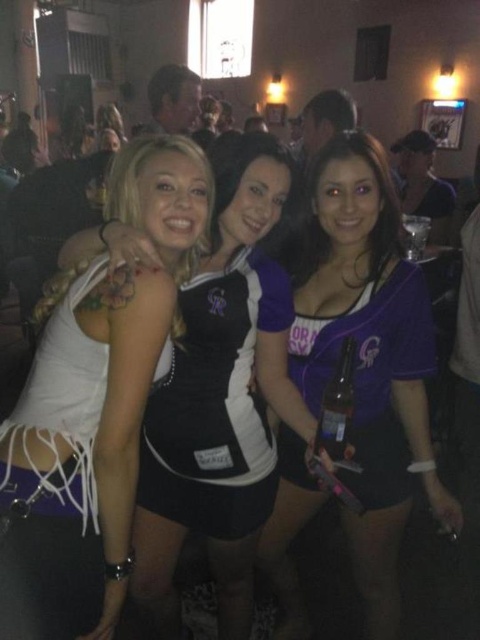
You are standing in the middle of the room and want to find the white matte dress at center. According to the coordinates provided, in which direction should you look to locate it?

The white matte dress at center is located at coordinates point (223, 401), so you should look to the right and slightly above your current position to locate it.

You are a photographer standing at a certain distance from the white matte dress at center. You want to ensure that the subject is in focus. If your camera has a minimum focusing distance of 1.2 meters, will you need to adjust your position?

The distance between you and the white matte dress at center is 1.31 meters. Since your camera can focus as close as 1.2 meters, you are within the minimum focusing distance. To keep the subject in focus, you should move slightly closer to the white matte dress at center so that the distance is at least 1.2 meters or more.